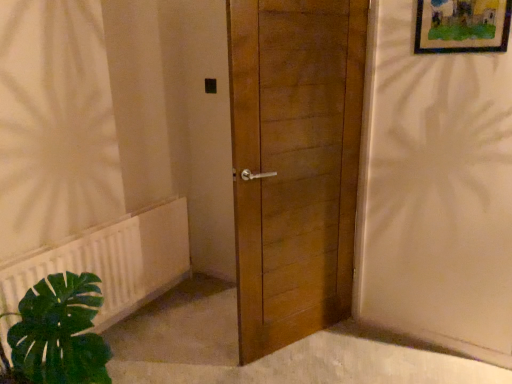
Based on the photo, in order to face wooden framed artwork at upper right, should I rotate leftwards or rightwards?

A 25.664 degree turn to the right will do.

This screenshot has width=512, height=384. What are the coordinates of `white plastic radiator at lower left` in the screenshot? It's located at (113, 261).

Does wooden framed artwork at upper right have a lesser height compared to white plastic radiator at lower left?

Correct, wooden framed artwork at upper right is not as tall as white plastic radiator at lower left.

Is wooden framed artwork at upper right wider than white plastic radiator at lower left?

In fact, wooden framed artwork at upper right might be narrower than white plastic radiator at lower left.

From a real-world perspective, is wooden framed artwork at upper right above or below white plastic radiator at lower left?

Clearly, from a real-world perspective, wooden framed artwork at upper right is above white plastic radiator at lower left.

Is point (453, 14) positioned before point (157, 258)?

Yes, it is.

Is wooden door at center looking in the opposite direction of wooden framed artwork at upper right?

No.

From the image's perspective, is wooden door at center below wooden framed artwork at upper right?

Yes.

From the picture: From a real-world perspective, between wooden door at center and wooden framed artwork at upper right, who is vertically higher?

wooden framed artwork at upper right, from a real-world perspective.

Consider the image. Which is less distant, (439, 17) or (288, 207)?

Point (439, 17)

Is wooden framed artwork at upper right looking in the opposite direction of wooden door at center?

No, wooden door at center is not at the back of wooden framed artwork at upper right.

From a real-world perspective, is wooden framed artwork at upper right physically above wooden door at center?

Yes, from a real-world perspective, wooden framed artwork at upper right is on top of wooden door at center.

Looking at this image, is wooden door at center oriented away from white plastic radiator at lower left?

No, wooden door at center's orientation is not away from white plastic radiator at lower left.

Can you confirm if wooden door at center is positioned to the right of white plastic radiator at lower left?

Yes, wooden door at center is to the right of white plastic radiator at lower left.

Which object is closer to the camera taking this photo, wooden door at center or white plastic radiator at lower left?

wooden door at center.

Considering the relative sizes of wooden door at center and white plastic radiator at lower left in the image provided, is wooden door at center thinner than white plastic radiator at lower left?

Incorrect, the width of wooden door at center is not less than that of white plastic radiator at lower left.

Which object is closer to the camera, white plastic radiator at lower left or wooden door at center?

Positioned in front is wooden door at center.

Is white plastic radiator at lower left surrounding wooden door at center?

That's incorrect, wooden door at center is not inside white plastic radiator at lower left.

Is white plastic radiator at lower left positioned with its back to wooden door at center?

white plastic radiator at lower left is not turned away from wooden door at center.

Is white plastic radiator at lower left thinner than wooden door at center?

Correct, the width of white plastic radiator at lower left is less than that of wooden door at center.

Are white plastic radiator at lower left and wooden framed artwork at upper right far apart?

Yes, white plastic radiator at lower left and wooden framed artwork at upper right are quite far apart.

Is white plastic radiator at lower left bigger or smaller than wooden framed artwork at upper right?

white plastic radiator at lower left is bigger than wooden framed artwork at upper right.

Is white plastic radiator at lower left not within wooden framed artwork at upper right?

Yes, white plastic radiator at lower left is not within wooden framed artwork at upper right.

How different are the orientations of white plastic radiator at lower left and wooden framed artwork at upper right in degrees?

The angular difference between white plastic radiator at lower left and wooden framed artwork at upper right is 89.4 degrees.

Where is `radiator below the wooden framed artwork at upper right (from the image's perspective)`? The image size is (512, 384). radiator below the wooden framed artwork at upper right (from the image's perspective) is located at coordinates (113, 261).

Find the location of a particular element. Image resolution: width=512 pixels, height=384 pixels. picture frame located on the right of wooden door at center is located at coordinates (462, 26).

Estimate the real-world distances between objects in this image. Which object is closer to wooden framed artwork at upper right, white plastic radiator at lower left or wooden door at center?

Based on the image, wooden door at center appears to be nearer to wooden framed artwork at upper right.

When comparing their distances from white plastic radiator at lower left, does wooden door at center or wooden framed artwork at upper right seem closer?

Among the two, wooden door at center is located nearer to white plastic radiator at lower left.

When comparing their distances from wooden door at center, does wooden framed artwork at upper right or white plastic radiator at lower left seem further?

white plastic radiator at lower left is positioned further to the anchor wooden door at center.

Looking at the image, which one is located further to wooden framed artwork at upper right, wooden door at center or white plastic radiator at lower left?

white plastic radiator at lower left lies further to wooden framed artwork at upper right than the other object.

From the image, which object appears to be farther from wooden door at center, white plastic radiator at lower left or wooden framed artwork at upper right?

white plastic radiator at lower left is positioned further to the anchor wooden door at center.

Which object lies further to the anchor point white plastic radiator at lower left, wooden framed artwork at upper right or wooden door at center?

wooden framed artwork at upper right lies further to white plastic radiator at lower left than the other object.

Find the location of a particular element. door situated between white plastic radiator at lower left and wooden framed artwork at upper right from left to right is located at coordinates [294, 163].